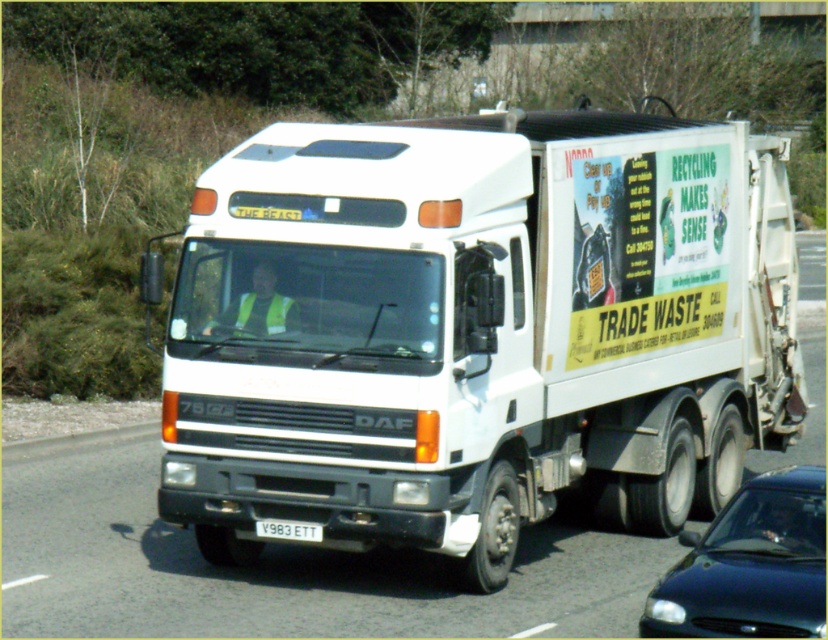
Question: Does metallic blue sedan at lower right lie behind white plastic license plate at center?

Choices:
 (A) yes
 (B) no

Answer: (B)

Question: Does white matte truck at center have a larger size compared to metallic blue sedan at lower right?

Choices:
 (A) yes
 (B) no

Answer: (B)

Question: Which object is the farthest from the metallic blue sedan at lower right?

Choices:
 (A) white plastic license plate at center
 (B) white matte truck at center

Answer: (A)

Question: Which point is farther to the camera?

Choices:
 (A) white plastic license plate at center
 (B) metallic blue sedan at lower right

Answer: (A)

Question: Is white matte truck at center in front of metallic blue sedan at lower right?

Choices:
 (A) yes
 (B) no

Answer: (B)

Question: Estimate the real-world distances between objects in this image. Which object is farther from the white plastic license plate at center?

Choices:
 (A) metallic blue sedan at lower right
 (B) white matte truck at center

Answer: (A)